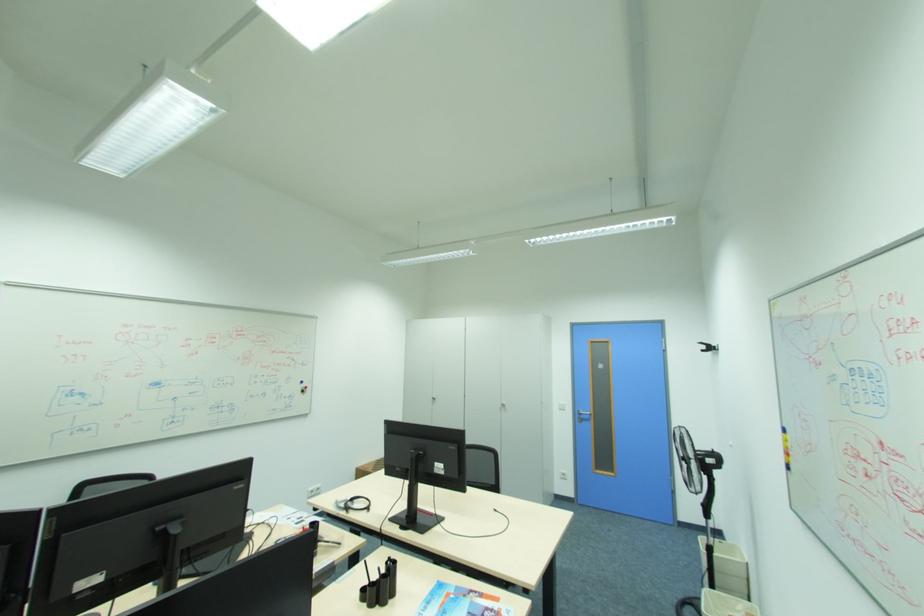
The location [459,602] corresponds to which object?

This point indicates the blue booklet.